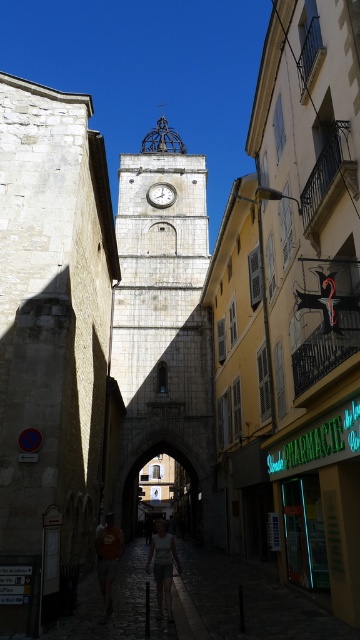
You are a tourist standing on the street looking at the historic tower. You notice an orange cotton shirt at lower center and a silver metallic clock at center. Which object is positioned closer to your left side?

The orange cotton shirt at lower center is positioned to the left of the silver metallic clock at center, so it is closer to your left side.

You are a tourist standing in the historic town square and notice both the stone clock tower at center and the white cotton shirt at center. Which object appears wider from your vantage point?

The stone clock tower at center appears wider than the white cotton shirt at center because its width is larger according to the description.